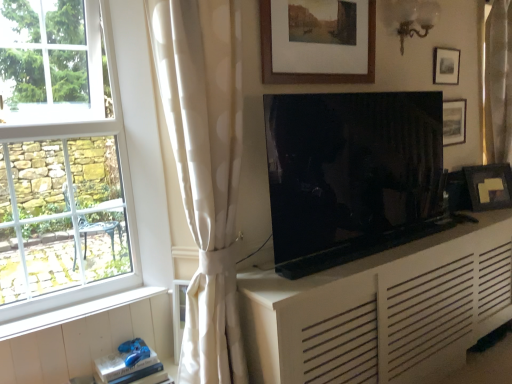
This screenshot has width=512, height=384. What do you see at coordinates (205, 170) in the screenshot?
I see `white dotted fabric at center, marked as the second curtain in a back-to-front arrangement` at bounding box center [205, 170].

At what (x,y) coordinates should I click in order to perform the action: click on white dotted fabric at center, marked as the second curtain in a back-to-front arrangement. Please return your answer as a coordinate pair (x, y). Image resolution: width=512 pixels, height=384 pixels. Looking at the image, I should click on (205, 170).

What do you see at coordinates (352, 175) in the screenshot? I see `matte black tv at center` at bounding box center [352, 175].

You are a GUI agent. You are given a task and a screenshot of the screen. Output one action in this format:
    pyautogui.click(x=<x>, y=<y>)
    Task: Click on the matte black picture frame at upper right, marked as the 2th picture frame in a front-to-back arrangement
    The height and width of the screenshot is (384, 512).
    Given the screenshot: What is the action you would take?
    pyautogui.click(x=446, y=66)

This screenshot has width=512, height=384. In order to click on white matte cabinet at center in this screenshot , I will do `click(382, 310)`.

This screenshot has height=384, width=512. I want to click on white dotted fabric at center, the second curtain from the right, so click(x=205, y=170).

From their relative heights in the image, would you say white glass window at left is taller or shorter than matte black picture frame at right, placed as the first picture frame when sorted from back to front?

Clearly, white glass window at left is taller compared to matte black picture frame at right, placed as the first picture frame when sorted from back to front.

From the image's perspective, which is below, white glass window at left or matte black picture frame at right, arranged as the 4th picture frame when viewed from the left?

matte black picture frame at right, arranged as the 4th picture frame when viewed from the left, appears lower in the image.

At what (x,y) coordinates should I click in order to perform the action: click on window in front of the matte black picture frame at right, the fourth picture frame in the front-to-back sequence. Please return your answer as a coordinate pair (x, y). The image size is (512, 384). Looking at the image, I should click on (68, 203).

In the scene shown: From a real-world perspective, is white glass window at left on matte black picture frame at right, arranged as the 4th picture frame when viewed from the left?

Yes, from a real-world perspective, white glass window at left is above matte black picture frame at right, arranged as the 4th picture frame when viewed from the left.

Which object is closer to the camera, gold fabric curtain at right, arranged as the 1th curtain when viewed from the right, or white dotted fabric at center, positioned as the first curtain in left-to-right order?

white dotted fabric at center, positioned as the first curtain in left-to-right order, is closer to the camera.

Is there a large distance between gold fabric curtain at right, arranged as the 1th curtain when viewed from the right, and white dotted fabric at center, marked as the second curtain in a back-to-front arrangement?

Absolutely, gold fabric curtain at right, arranged as the 1th curtain when viewed from the right, is distant from white dotted fabric at center, marked as the second curtain in a back-to-front arrangement.

Can you confirm if gold fabric curtain at right, positioned as the second curtain in left-to-right order, is thinner than white dotted fabric at center, the second curtain from the right?

Yes, gold fabric curtain at right, positioned as the second curtain in left-to-right order, is thinner than white dotted fabric at center, the second curtain from the right.

From a real-world perspective, is gold fabric curtain at right, which appears as the first curtain when viewed from the back, above or below white dotted fabric at center, positioned as the first curtain in left-to-right order?

In terms of real-world spatial position, gold fabric curtain at right, which appears as the first curtain when viewed from the back, is above white dotted fabric at center, positioned as the first curtain in left-to-right order.

Could you tell me if white matte cabinet at center is facing wooden framed picture at upper center, the 4th picture frame positioned from the right?

No, white matte cabinet at center does not turn towards wooden framed picture at upper center, the 4th picture frame positioned from the right.

From the image's perspective, is white matte cabinet at center under wooden framed picture at upper center, placed as the 1th picture frame when sorted from front to back?

Yes, from the image's perspective, white matte cabinet at center is beneath wooden framed picture at upper center, placed as the 1th picture frame when sorted from front to back.

From a real-world perspective, is white matte cabinet at center positioned above or below wooden framed picture at upper center, the 4th picture frame from the back?

white matte cabinet at center is situated lower than wooden framed picture at upper center, the 4th picture frame from the back, in the real world.

What's the angular difference between white matte cabinet at center and wooden framed picture at upper center, marked as the first picture frame in a left-to-right arrangement,'s facing directions?

0.0773 degrees separate the facing orientations of white matte cabinet at center and wooden framed picture at upper center, marked as the first picture frame in a left-to-right arrangement.

Does wooden picture frame at upper right, marked as the 3th picture frame in a left-to-right arrangement, lie in front of white wood at lower left?

No, the depth of wooden picture frame at upper right, marked as the 3th picture frame in a left-to-right arrangement, is greater than that of white wood at lower left.

From a real-world perspective, is wooden picture frame at upper right, marked as the 3th picture frame in a left-to-right arrangement, positioned over white wood at lower left based on gravity?

Indeed, from a real-world perspective, wooden picture frame at upper right, marked as the 3th picture frame in a left-to-right arrangement, stands above white wood at lower left.

Considering the relative positions of wooden picture frame at upper right, marked as the 3th picture frame in a left-to-right arrangement, and white wood at lower left in the image provided, is wooden picture frame at upper right, marked as the 3th picture frame in a left-to-right arrangement, to the left of white wood at lower left from the viewer's perspective?

No.

In terms of width, does matte black picture frame at right, arranged as the 4th picture frame when viewed from the left, look wider or thinner when compared to wooden framed picture at upper center, marked as the first picture frame in a left-to-right arrangement?

Clearly, matte black picture frame at right, arranged as the 4th picture frame when viewed from the left, has more width compared to wooden framed picture at upper center, marked as the first picture frame in a left-to-right arrangement.

Is matte black picture frame at right, arranged as the 4th picture frame when viewed from the left, positioned in front of wooden framed picture at upper center, the 4th picture frame from the back?

No, it is not.

Is matte black picture frame at right, the first picture frame in the right-to-left sequence, positioned with its back to wooden framed picture at upper center, marked as the first picture frame in a left-to-right arrangement?

That's not correct — matte black picture frame at right, the first picture frame in the right-to-left sequence, is not looking away from wooden framed picture at upper center, marked as the first picture frame in a left-to-right arrangement.

Would you say matte black picture frame at right, placed as the first picture frame when sorted from back to front, is to the left or to the right of wooden framed picture at upper center, the 4th picture frame from the back, in the picture?

Based on their positions, matte black picture frame at right, placed as the first picture frame when sorted from back to front, is located to the right of wooden framed picture at upper center, the 4th picture frame from the back.

From the image's perspective, which one is positioned higher, white matte cabinet at center or wooden picture frame at upper right, placed as the third picture frame when sorted from front to back?

wooden picture frame at upper right, placed as the third picture frame when sorted from front to back, is shown above in the image.

Between white matte cabinet at center and wooden picture frame at upper right, acting as the 2th picture frame starting from the right, which one appears on the right side from the viewer's perspective?

Positioned to the right is wooden picture frame at upper right, acting as the 2th picture frame starting from the right.

Would you consider white matte cabinet at center to be distant from wooden picture frame at upper right, placed as the third picture frame when sorted from front to back?

Yes.

Considering the relative sizes of white matte cabinet at center and wooden picture frame at upper right, placed as the third picture frame when sorted from front to back, in the image provided, is white matte cabinet at center shorter than wooden picture frame at upper right, placed as the third picture frame when sorted from front to back,?

No, white matte cabinet at center is not shorter than wooden picture frame at upper right, placed as the third picture frame when sorted from front to back.

From the image's perspective, between matte black tv at center and white dotted fabric at center, positioned as the first curtain in left-to-right order, which one is located above?

matte black tv at center.

Considering the relative positions of matte black tv at center and white dotted fabric at center, marked as the second curtain in a back-to-front arrangement, in the image provided, is matte black tv at center to the left of white dotted fabric at center, marked as the second curtain in a back-to-front arrangement, from the viewer's perspective?

No.

Could you measure the distance between matte black tv at center and white dotted fabric at center, positioned as the first curtain in left-to-right order?

22.67 inches.

Locate an element on the screen. The height and width of the screenshot is (384, 512). curtain below the matte black tv at center (from the image's perspective) is located at coordinates (205, 170).

Starting from the white glass window at left, which picture frame is the 4th one to the right? Please provide its 2D coordinates.

[(489, 186)]

Where is `curtain positioned vertically above the white dotted fabric at center, marked as the second curtain in a back-to-front arrangement (from a real-world perspective)`? curtain positioned vertically above the white dotted fabric at center, marked as the second curtain in a back-to-front arrangement (from a real-world perspective) is located at coordinates (498, 80).

Considering their positions, is wooden framed picture at upper center, the 4th picture frame positioned from the right, positioned closer to wooden picture frame at upper right, acting as the 2th picture frame starting from the right, than white matte cabinet at center?

wooden framed picture at upper center, the 4th picture frame positioned from the right, is closer to wooden picture frame at upper right, acting as the 2th picture frame starting from the right.

When comparing their distances from matte black picture frame at upper right, the 2th picture frame from the left, does matte black picture frame at right, the first picture frame in the right-to-left sequence, or white glass window at left seem closer?

matte black picture frame at right, the first picture frame in the right-to-left sequence, is closer to matte black picture frame at upper right, the 2th picture frame from the left.

When comparing their distances from white wood at lower left, does matte black picture frame at upper right, the 2th picture frame from the left, or white matte cabinet at center seem further?

Among the two, matte black picture frame at upper right, the 2th picture frame from the left, is located further to white wood at lower left.

Looking at the image, which one is located closer to white dotted fabric at center, the second curtain from the right, white glass window at left or white wood at lower left?

The object closer to white dotted fabric at center, the second curtain from the right, is white glass window at left.

Based on their spatial positions, is white glass window at left or wooden picture frame at upper right, which ranks as the 2th picture frame in back-to-front order, closer to white matte cabinet at center?

white glass window at left is closer to white matte cabinet at center.

Which object lies nearer to the anchor point white wood at lower left, white matte cabinet at center or matte black tv at center?

The object closer to white wood at lower left is white matte cabinet at center.

Based on their spatial positions, is white wood at lower left or matte black picture frame at right, arranged as the 4th picture frame when viewed from the left, further from matte black picture frame at upper right, the 3th picture frame in the right-to-left sequence?

white wood at lower left.

Estimate the real-world distances between objects in this image. Which object is further from wooden picture frame at upper right, which ranks as the 2th picture frame in back-to-front order, white wood at lower left or matte black picture frame at upper right, the 3th picture frame in the right-to-left sequence?

Among the two, white wood at lower left is located further to wooden picture frame at upper right, which ranks as the 2th picture frame in back-to-front order.

Where is `television between wooden framed picture at upper center, marked as the first picture frame in a left-to-right arrangement, and gold fabric curtain at right, the 2th curtain positioned from the front, in the horizontal direction`? Image resolution: width=512 pixels, height=384 pixels. television between wooden framed picture at upper center, marked as the first picture frame in a left-to-right arrangement, and gold fabric curtain at right, the 2th curtain positioned from the front, in the horizontal direction is located at coordinates (352, 175).

Find the location of a particular element. television between wooden framed picture at upper center, the 4th picture frame positioned from the right, and white dotted fabric at center, marked as the second curtain in a back-to-front arrangement, in the up-down direction is located at coordinates (352, 175).

Identify the location of curtain positioned between white matte cabinet at center and matte black picture frame at right, the first picture frame in the right-to-left sequence, from near to far. This screenshot has height=384, width=512. (498, 80).

Where is `curtain located between white wood at lower left and wooden picture frame at upper right, acting as the 2th picture frame starting from the right, in the left-right direction`? This screenshot has height=384, width=512. curtain located between white wood at lower left and wooden picture frame at upper right, acting as the 2th picture frame starting from the right, in the left-right direction is located at coordinates (205, 170).